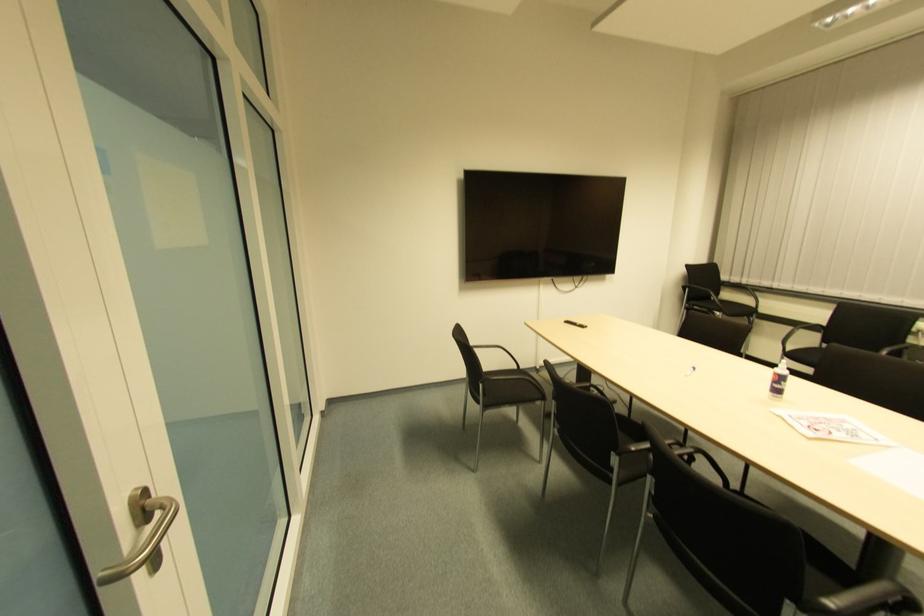
This screenshot has width=924, height=616. Find the location of `chair sitting surface`. chair sitting surface is located at coordinates (504, 387).